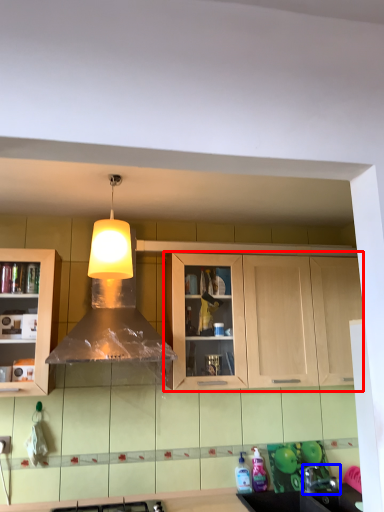
Question: Which point is further to the camera, cabinetry (highlighted by a red box) or faucet (highlighted by a blue box)?

Choices:
 (A) cabinetry
 (B) faucet

Answer: (A)